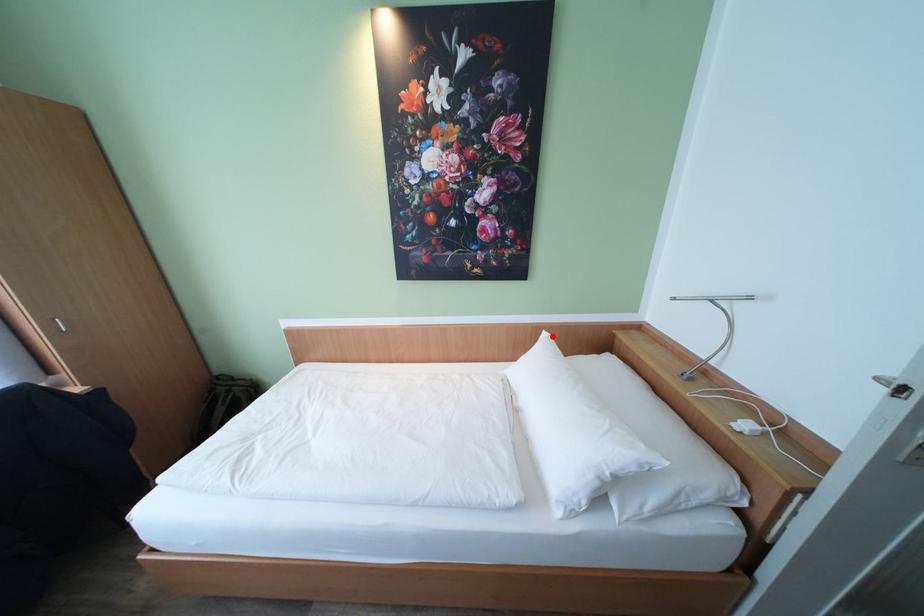
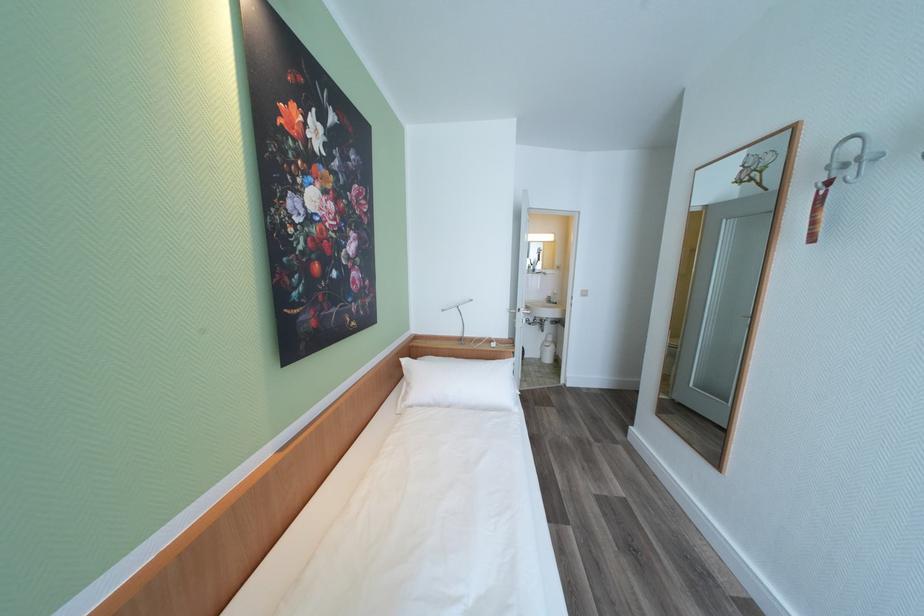
Locate, in the second image, the point that corresponds to the highlighted location in the first image.

(411, 362)